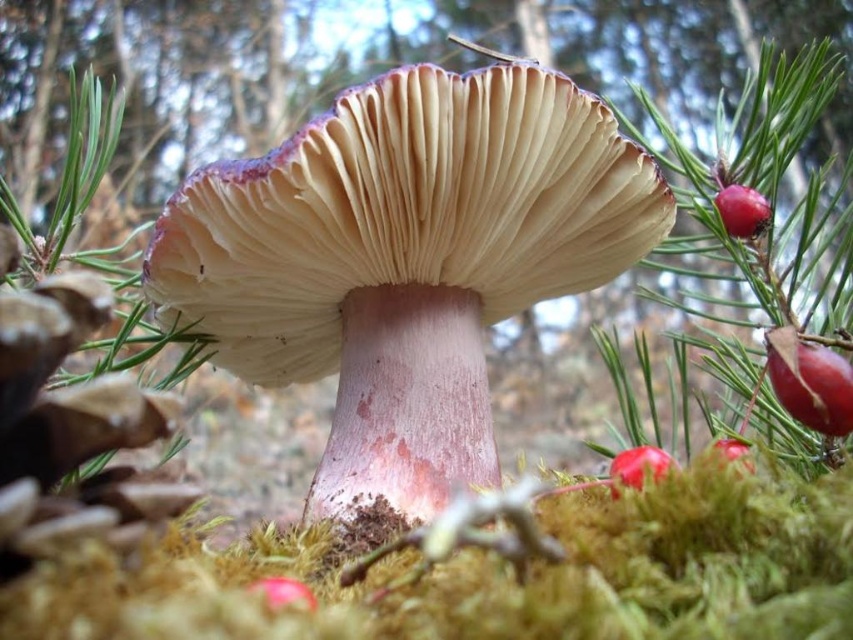
Question: Which object is the closest to the glossy red berry at upper right?

Choices:
 (A) glossy red berry at center right
 (B) glossy red berry at lower right

Answer: (B)

Question: Which of these objects is positioned closest to the glossy red berry at center right?

Choices:
 (A) glossy red berry at upper right
 (B) glossy red berry at lower right

Answer: (B)

Question: Which point is farther from the camera taking this photo?

Choices:
 (A) (732, 440)
 (B) (718, 195)
 (C) (662, 474)

Answer: (B)

Question: Does glossy red berry at lower right have a lesser width compared to glossy red berry at center right?

Choices:
 (A) no
 (B) yes

Answer: (A)

Question: Does glossy red berry at lower right appear under glossy red berry at center right?

Choices:
 (A) yes
 (B) no

Answer: (A)

Question: Is glossy red berry at upper right behind glossy red berry at lower right?

Choices:
 (A) yes
 (B) no

Answer: (A)